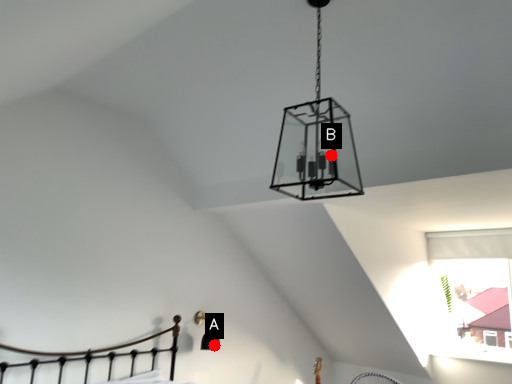
Question: Two points are circled on the image, labeled by A and B beside each circle. Which of the following is the closest to the observer?

Choices:
 (A) A is closer
 (B) B is closer

Answer: (B)